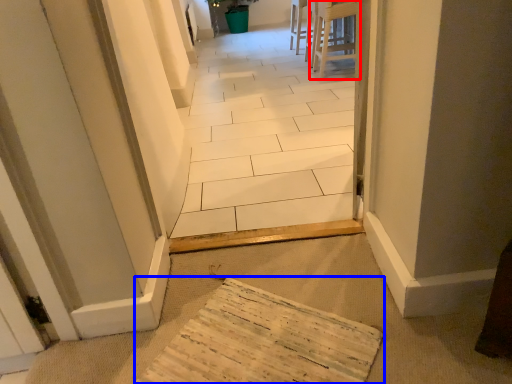
Question: Which object is further to the camera taking this photo, furniture (highlighted by a red box) or cardboard (highlighted by a blue box)?

Choices:
 (A) furniture
 (B) cardboard

Answer: (A)